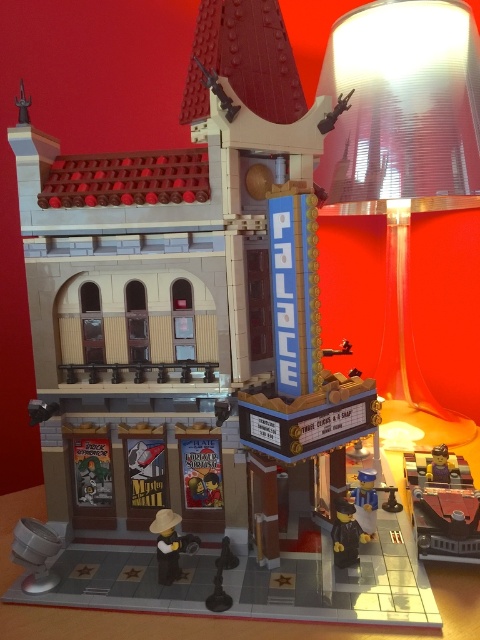
Question: Which of the following is the closest to the observer?

Choices:
 (A) metallic gold car at lower right
 (B) brown matte hat at lower center
 (C) blue plastic toy at center
 (D) dark gray plastic figure at center

Answer: (B)

Question: Does brown matte hat at lower center have a lesser width compared to blue plastic toy at center?

Choices:
 (A) yes
 (B) no

Answer: (B)

Question: Estimate the real-world distances between objects in this image. Which object is farther from the blue plastic toy at center?

Choices:
 (A) metallic gold car at lower right
 (B) transparent plastic lampshade at upper right
 (C) dark gray plastic figure at center
 (D) brown matte hat at lower center

Answer: (B)

Question: Estimate the real-world distances between objects in this image. Which object is closer to the transparent plastic lampshade at upper right?

Choices:
 (A) dark gray plastic figure at center
 (B) brick minifigure at center

Answer: (B)

Question: Can you confirm if dark gray plastic figure at center is positioned to the right of brick minifigure at center?

Choices:
 (A) yes
 (B) no

Answer: (B)

Question: Is the position of brown matte hat at lower center more distant than that of blue plastic toy at center?

Choices:
 (A) yes
 (B) no

Answer: (B)